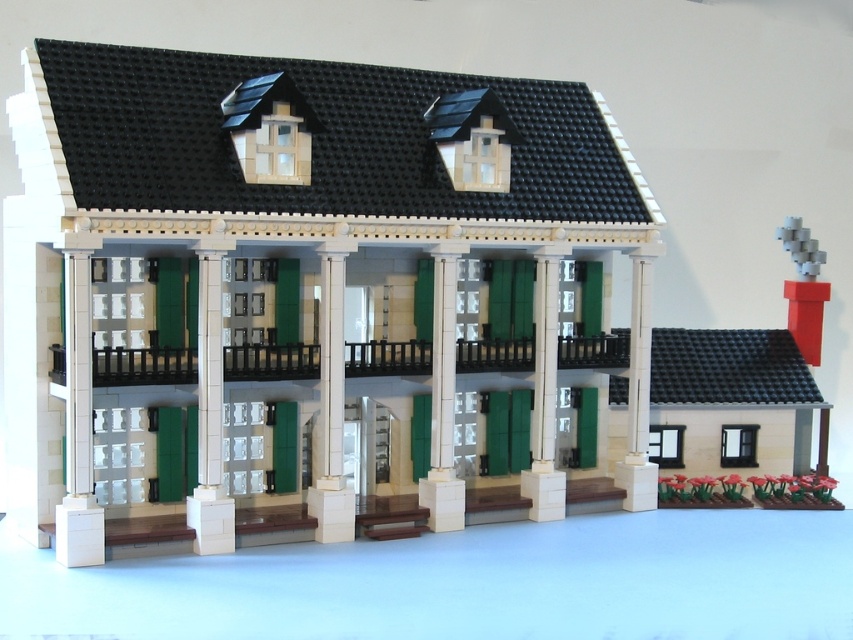
Is white smooth column at center bigger than white glossy column at center?

Yes.

Where is `white smooth column at center`? This screenshot has width=853, height=640. white smooth column at center is located at coordinates (331, 403).

The width and height of the screenshot is (853, 640). In order to click on white smooth column at center in this screenshot , I will do `click(331, 403)`.

Is beige/smooth pillar at center closer to camera compared to white glossy column at center?

Yes, beige/smooth pillar at center is in front of white glossy column at center.

Who is positioned more to the left, beige/smooth pillar at center or white glossy column at center?

Positioned to the left is beige/smooth pillar at center.

Is point (219, 541) farther from viewer compared to point (436, 339)?

No, (219, 541) is closer to viewer.

The height and width of the screenshot is (640, 853). In order to click on beige/smooth pillar at center in this screenshot , I will do `click(210, 410)`.

Does beige/smooth pillar at center lie in front of white smooth column at center?

Yes, beige/smooth pillar at center is in front of white smooth column at center.

Is point (222, 477) farther from camera compared to point (340, 476)?

That is False.

This screenshot has width=853, height=640. I want to click on beige/smooth pillar at center, so click(210, 410).